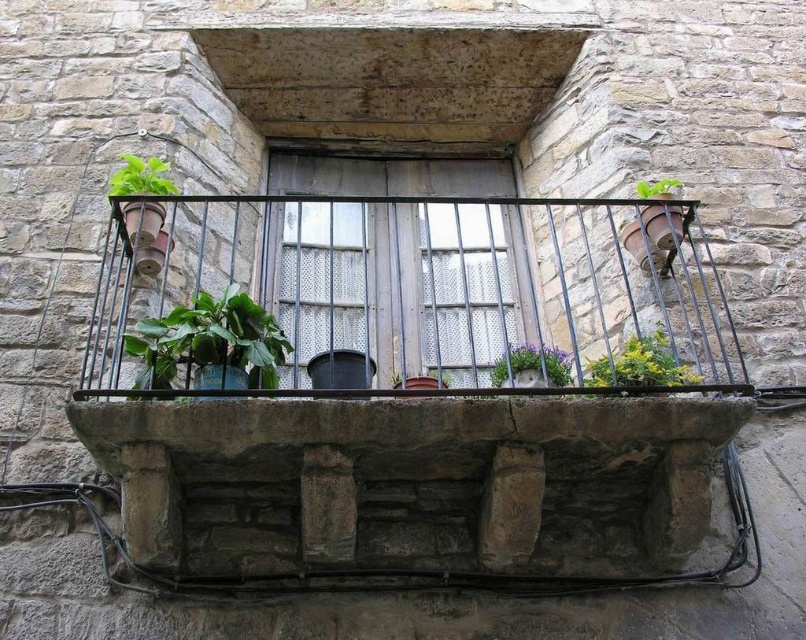
Can you confirm if green matte leafy plant at center is positioned to the right of green matte plant at upper right?

Incorrect, green matte leafy plant at center is not on the right side of green matte plant at upper right.

I want to click on green matte leafy plant at center, so click(210, 342).

Find the location of a particular element. The width and height of the screenshot is (806, 640). green matte leafy plant at center is located at coordinates (210, 342).

I want to click on green matte leafy plant at center, so click(210, 342).

In the scene shown: Which of these two, green matte plant at upper left or green matte plant at upper right, stands taller?

With more height is green matte plant at upper left.

Does green matte plant at upper left have a greater height compared to green matte plant at upper right?

Yes.

Who is more forward, (148,170) or (676,182)?

Positioned in front is point (148,170).

Locate an element on the screen. The image size is (806, 640). green matte plant at upper left is located at coordinates (140, 177).

Looking at this image, which of these two, green leafy plants at center or metallic grid at center, stands taller?

Standing taller between the two is green leafy plants at center.

Does green leafy plants at center appear over metallic grid at center?

Actually, green leafy plants at center is below metallic grid at center.

Image resolution: width=806 pixels, height=640 pixels. Describe the element at coordinates (405, 387) in the screenshot. I see `green leafy plants at center` at that location.

The image size is (806, 640). Identify the location of green leafy plants at center. [405, 387].